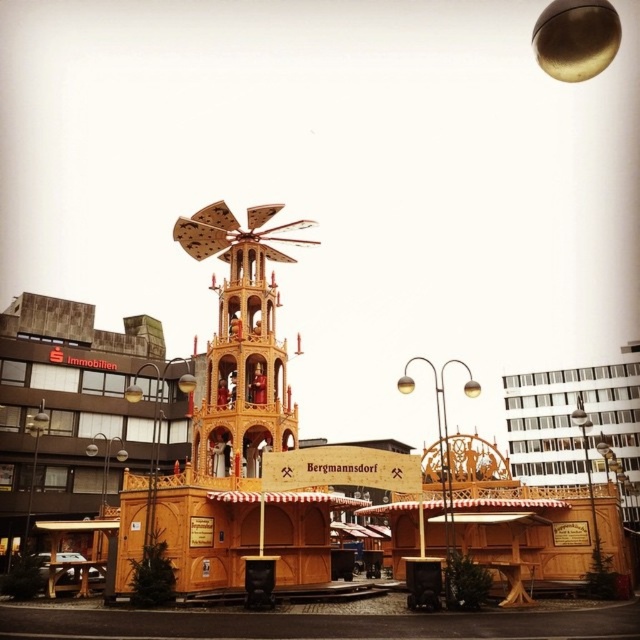
Does wooden christmas pyramid at center have a greater height compared to wooden windmill at center?

Correct, wooden christmas pyramid at center is much taller as wooden windmill at center.

Is wooden christmas pyramid at center to the left of wooden windmill at center from the viewer's perspective?

No, wooden christmas pyramid at center is not to the left of wooden windmill at center.

What do you see at coordinates (236, 449) in the screenshot? I see `wooden christmas pyramid at center` at bounding box center [236, 449].

Locate an element on the screen. This screenshot has height=640, width=640. wooden christmas pyramid at center is located at coordinates (236, 449).